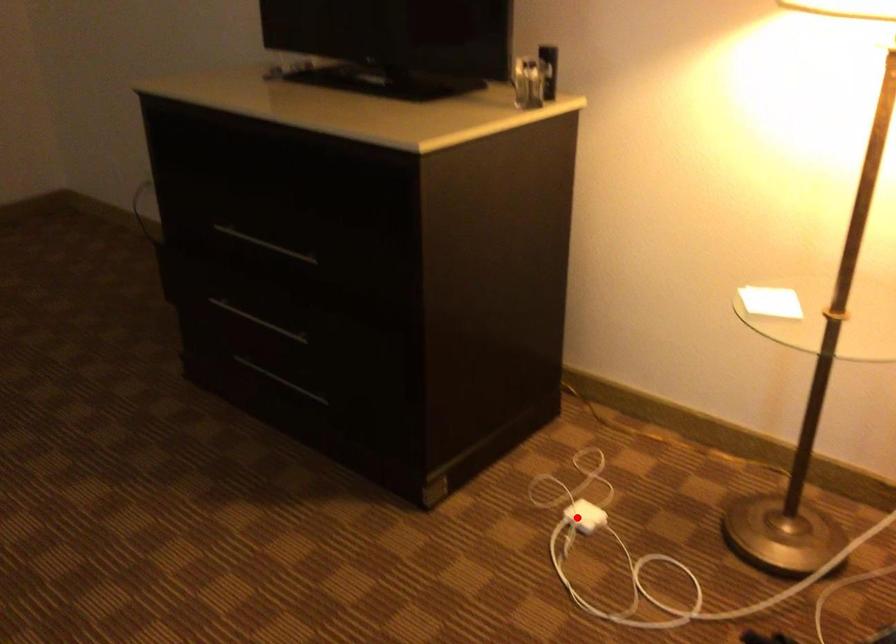
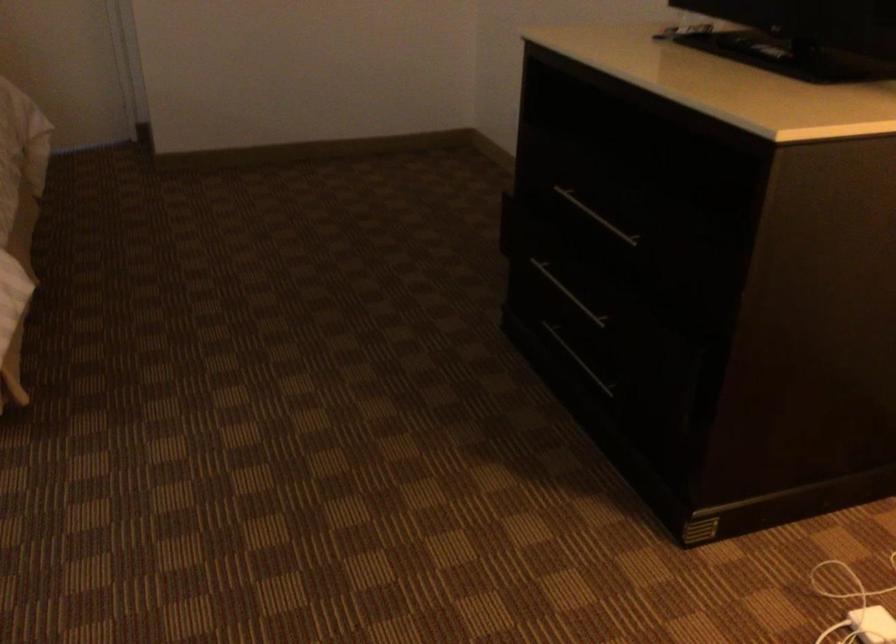
Where in the second image is the point corresponding to the highlighted location from the first image?

(872, 625)